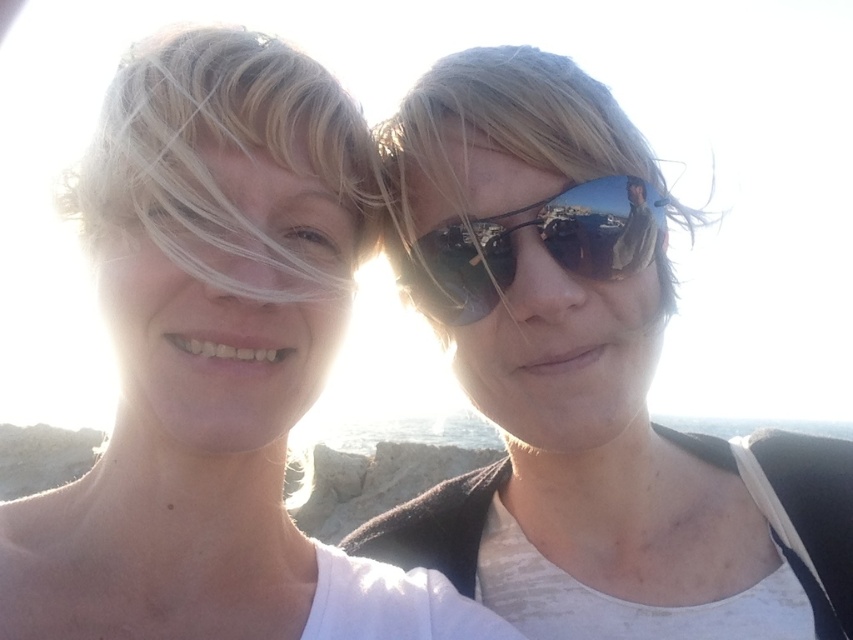
You are a photographer trying to capture a candid shot of the two people in the scene. The camera you are using has a maximum focus range of 36 inches. Can you focus on both the blonde hair at left and the sunglasses at right simultaneously?

The distance between the blonde hair at left and sunglasses at right is 36.61 inches. Since the camera can only focus within 36 inches, it cannot capture both subjects simultaneously within the focus range.

Consider the image. You are a photographer trying to capture a photo of the blonde hair at left. You need to focus your camera at a specific point to ensure the subject is clear. What are the coordinates where you should focus the camera?

You should focus the camera at the coordinates point (227, 148) where the blonde hair at left is located.

You are a photographer trying to capture a portrait of the two people in the scene. You want to ensure that the matte white tank top at center and the blonde hair at left are both clearly visible in the frame. Given their relative sizes in the image, which object should you focus on to ensure both are in focus?

The matte white tank top at center is taller than the blonde hair at left. To ensure both are in focus, focus on the matte white tank top at center since it is larger and closer to the camera, which will keep the blonde hair at left within the depth of field.